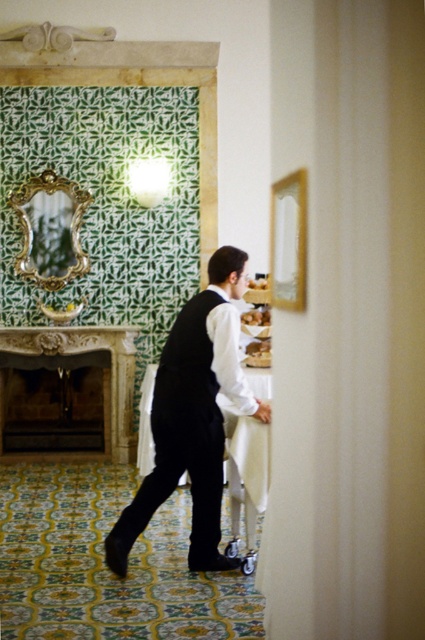
You are standing at the entrance of the room and see two points marked in the scene. The first point is labeled as point (277, 227) and the second is point (266, 280). Which point is closer to you?

Point (277, 227) is in front of point (266, 280), so it is closer to you.

You are standing in the room and want to hand a napkin to the man wearing the black satin vest at center. Considering your reach is about 1 meter, can you reach him without moving closer?

The distance between you and the black satin vest at center is 3.38 meters, which is much farther than your 1 meter reach. You cannot reach him without moving closer.